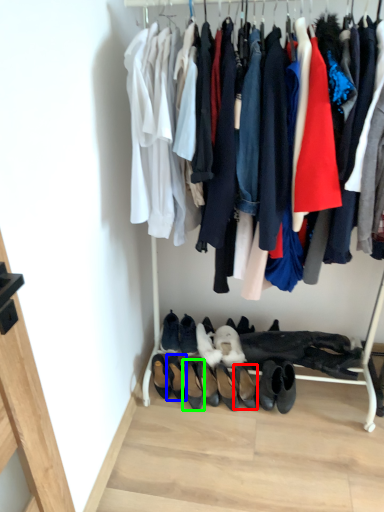
Question: Which object is positioned closest to footwear (highlighted by a red box)? Select from footwear (highlighted by a blue box) and footwear (highlighted by a green box).

Choices:
 (A) footwear
 (B) footwear

Answer: (B)